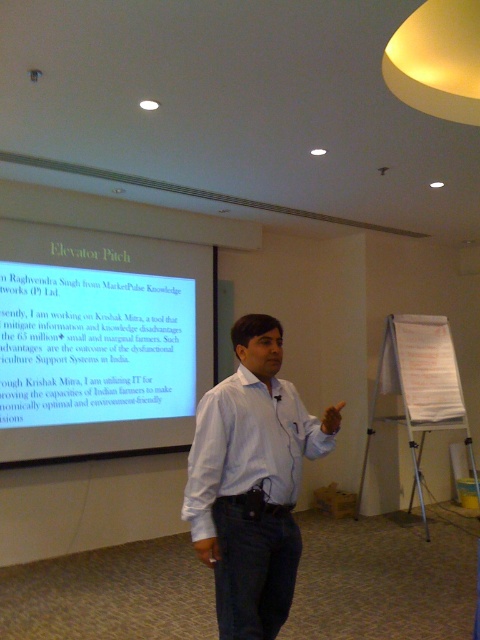
You are sitting in the front row of the conference room and want to see both the white shirt at center and the white glossy projector screen at upper left clearly. Which one will appear closer to you?

The white glossy projector screen at upper left will appear closer to you because the white shirt at center is behind it, making the screen more prominent in your line of sight.

You are a conference attendee who just entered the room and want to move from your current position to the white glossy projector screen at upper left to take a closer look at the content. However, you need to pass by the white shirt at center. Given that you are 1.7 meters tall, will you be able to walk comfortably between the two objects without any obstruction?

The distance between the white glossy projector screen at upper left and white shirt at center is 2.61 meters. Since you are 1.7 meters tall, the space between them is sufficient for you to walk comfortably without any obstruction as the distance is more than your height.

Looking at this image, you are a photographer in the audience at this presentation. You want to take a photo of the presenter and the screen. Since the screen is much taller than the white shirt, will you need to adjust your camera angle to include both the white glossy projector screen at upper left and the white shirt at center in the same frame?

Yes, the white glossy projector screen at upper left is much taller than the white shirt at center, so you will need to adjust your camera angle to include both in the same frame.